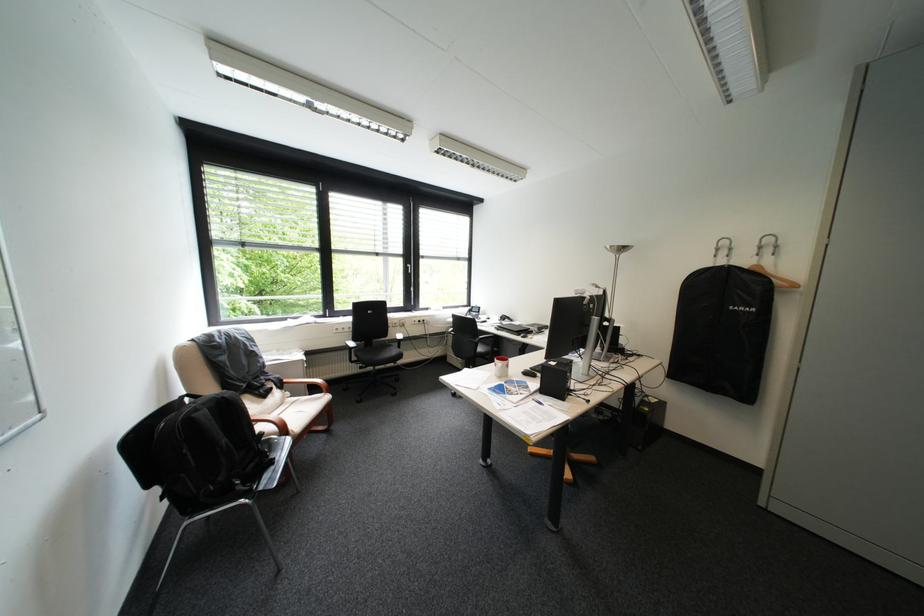
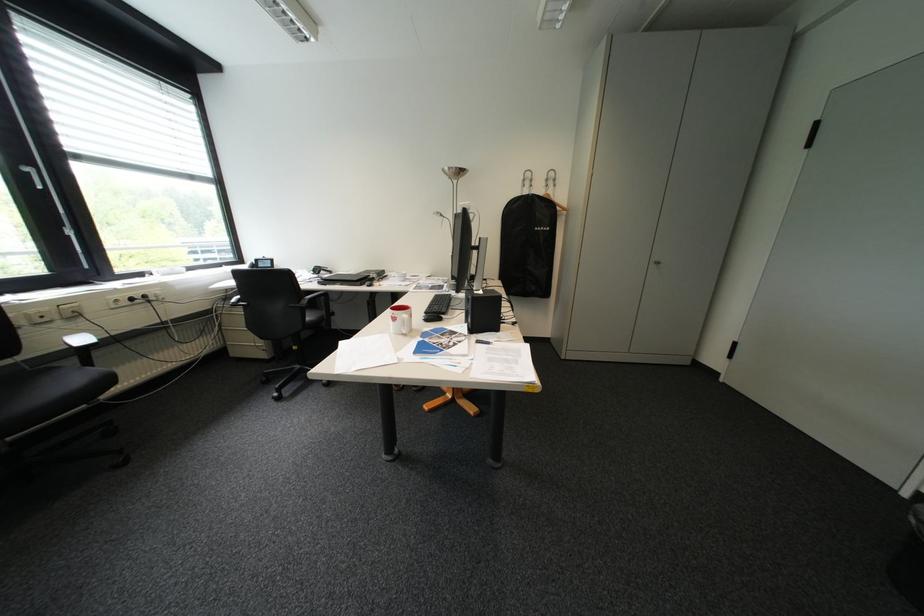
In the second image, find the point that corresponds to point (555, 392) in the first image.

(484, 331)